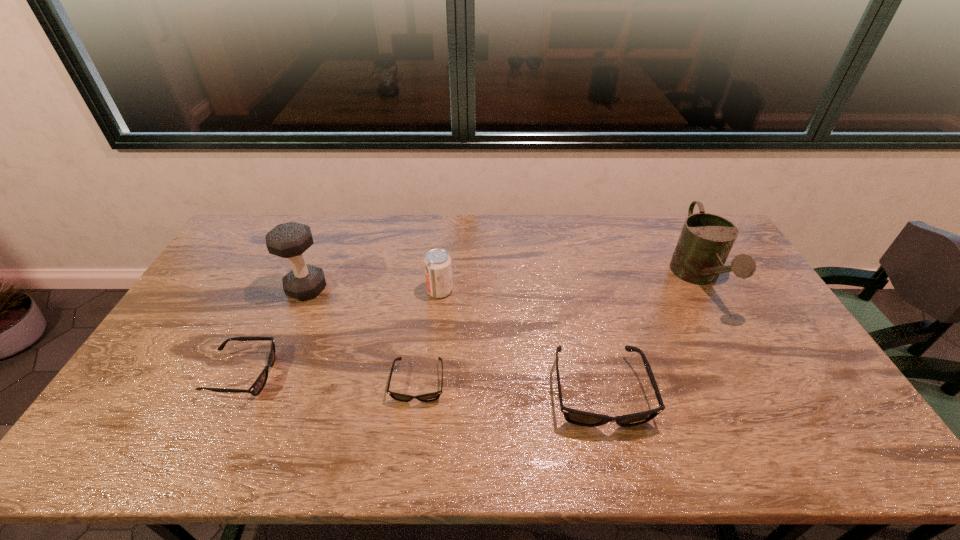
Identify the location of vacant place for an extra sunglasses on the right. The image size is (960, 540). (787, 400).